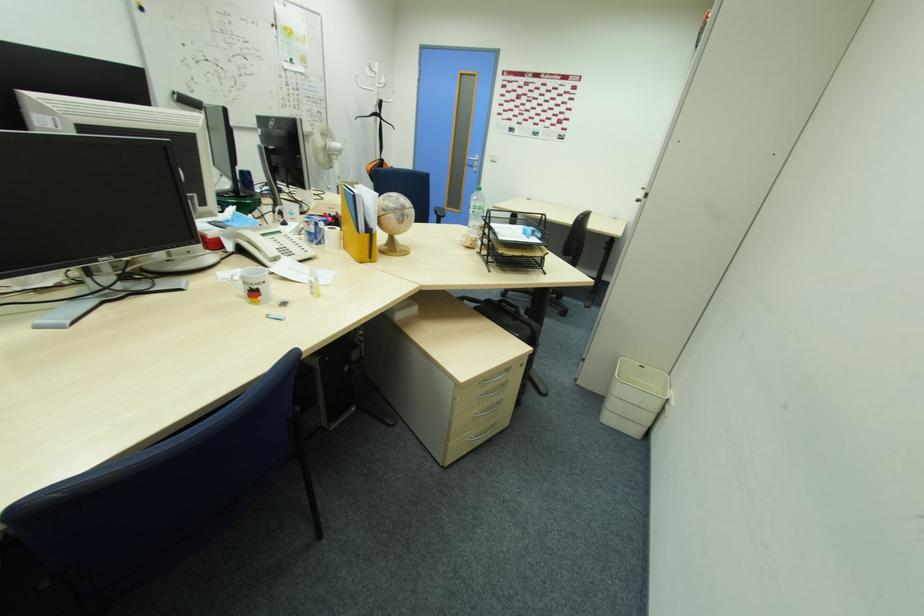
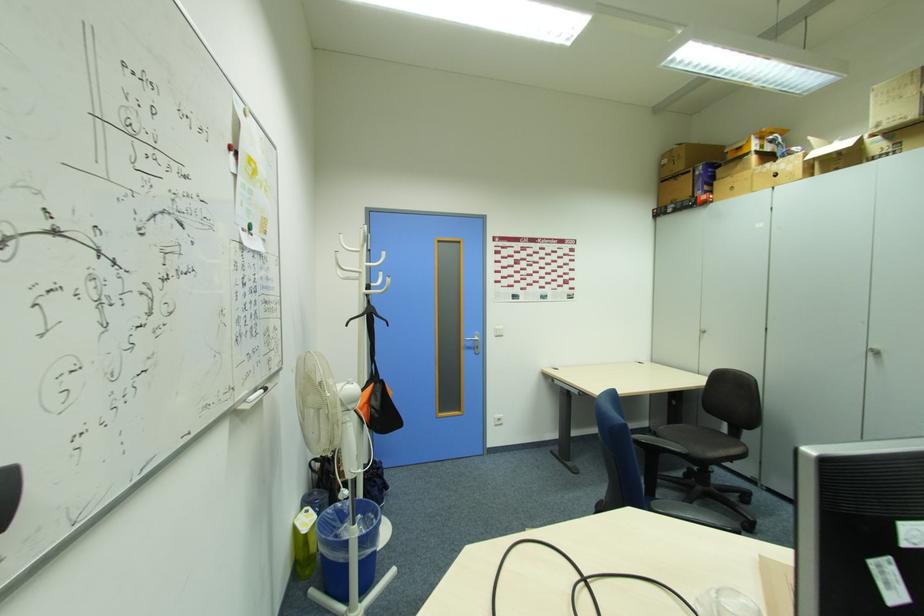
In the second image, find the point that corresponds to point (475, 164) in the first image.

(472, 346)